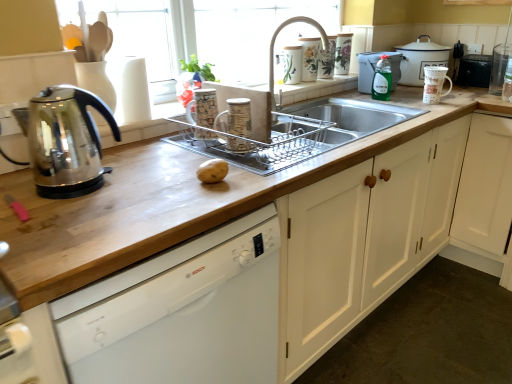
In order to face white enamel pot at upper right, which appears as the 3th kitchen appliance when ordered from the bottom, should I rotate leftwards or rightwards?

You should rotate right by 20.833 degrees.

What is the approximate height of matte ceramic mugs at center, the 1th appliance from the left?

The height of matte ceramic mugs at center, the 1th appliance from the left, is 6.93 inches.

This screenshot has width=512, height=384. I want to click on matte ceramic mugs at center, the seventh appliance in the right-to-left sequence, so click(203, 108).

This screenshot has height=384, width=512. Describe the element at coordinates (250, 33) in the screenshot. I see `transparent glass window screen at upper center` at that location.

Measure the distance between point (302, 28) and camera.

Point (302, 28) and camera are 6.94 feet apart from each other.

You are a GUI agent. You are given a task and a screenshot of the screen. Output one action in this format:
    pyautogui.click(x=<x>, y=<y>)
    Task: Click on the brown matte potato at center
    
    Given the screenshot: What is the action you would take?
    pyautogui.click(x=212, y=171)

Locate an element on the screen. Image resolution: width=512 pixels, height=384 pixels. transparent glass kettle at left, the first kitchen appliance in the left-to-right sequence is located at coordinates tap(66, 142).

Who is smaller, porcelain floral vase at upper center, which is the 4th appliance in left-to-right order, or transparent glass window screen at upper center?

porcelain floral vase at upper center, which is the 4th appliance in left-to-right order.

This screenshot has width=512, height=384. In order to click on the 1st appliance positioned above the transparent glass window screen at upper center (from the image's perspective) in this screenshot , I will do `click(309, 58)`.

Is transparent glass window screen at upper center at the back of porcelain floral vase at upper center, which is the 4th appliance in left-to-right order?

Yes, porcelain floral vase at upper center, which is the 4th appliance in left-to-right order, is positioned with its back facing transparent glass window screen at upper center.

Can you confirm if green plastic bottle at upper right, the 2th kitchen appliance ordered from the bottom, is positioned to the right of porcelain floral mug at upper center, the third appliance viewed from the left?

Indeed, green plastic bottle at upper right, the 2th kitchen appliance ordered from the bottom, is positioned on the right side of porcelain floral mug at upper center, the third appliance viewed from the left.

From the image's perspective, is green plastic bottle at upper right, the 2th kitchen appliance from the front, above porcelain floral mug at upper center, the fifth appliance when ordered from right to left?

No, from the image's perspective, green plastic bottle at upper right, the 2th kitchen appliance from the front, is not over porcelain floral mug at upper center, the fifth appliance when ordered from right to left.

Which of these two, green plastic bottle at upper right, positioned as the 2th kitchen appliance in right-to-left order, or porcelain floral mug at upper center, the fifth appliance when ordered from right to left, is bigger?

green plastic bottle at upper right, positioned as the 2th kitchen appliance in right-to-left order.

From the picture: Would you say porcelain floral mug at upper center, the fifth appliance when ordered from right to left, is inside or outside silver metallic faucet at upper center?

porcelain floral mug at upper center, the fifth appliance when ordered from right to left, is not inside silver metallic faucet at upper center, it's outside.

Can you confirm if porcelain floral mug at upper center, the fifth appliance when ordered from right to left, is taller than silver metallic faucet at upper center?

No, porcelain floral mug at upper center, the fifth appliance when ordered from right to left, is not taller than silver metallic faucet at upper center.

Does porcelain floral mug at upper center, the fifth appliance when ordered from right to left, have a greater width compared to silver metallic faucet at upper center?

Incorrect, the width of porcelain floral mug at upper center, the fifth appliance when ordered from right to left, does not surpass that of silver metallic faucet at upper center.

From the image's perspective, does porcelain floral mug at upper center, the fifth appliance when ordered from right to left, appear higher than silver metallic faucet at upper center?

Yes.

Is there a large distance between porcelain floral vase at upper center, positioned as the fifth appliance in left-to-right order, and matte ceramic mugs at center, the 1th appliance from the left?

Absolutely, porcelain floral vase at upper center, positioned as the fifth appliance in left-to-right order, is distant from matte ceramic mugs at center, the 1th appliance from the left.

How much distance is there between porcelain floral vase at upper center, positioned as the fifth appliance in left-to-right order, and matte ceramic mugs at center, the seventh appliance in the right-to-left sequence?

porcelain floral vase at upper center, positioned as the fifth appliance in left-to-right order, and matte ceramic mugs at center, the seventh appliance in the right-to-left sequence, are 1.11 meters apart.

Considering the positions of points (346, 50) and (192, 110), is point (346, 50) farther from camera compared to point (192, 110)?

Yes, point (346, 50) is farther from viewer.

Which object is further away from the camera, porcelain floral vase at upper center, positioned as the fifth appliance in left-to-right order, or matte ceramic mugs at center, the seventh appliance in the right-to-left sequence?

porcelain floral vase at upper center, positioned as the fifth appliance in left-to-right order.

Is white glossy dishwasher at center situated inside porcelain floral vase at upper center, which is the 4th appliance in left-to-right order, or outside?

white glossy dishwasher at center exists outside the volume of porcelain floral vase at upper center, which is the 4th appliance in left-to-right order.

Considering the relative sizes of white glossy dishwasher at center and porcelain floral vase at upper center, which is the 4th appliance in left-to-right order, in the image provided, is white glossy dishwasher at center bigger than porcelain floral vase at upper center, which is the 4th appliance in left-to-right order,?

Correct, white glossy dishwasher at center is larger in size than porcelain floral vase at upper center, which is the 4th appliance in left-to-right order.

From the white glossy dishwasher at center, count 4th appliance to the right and point to it. Please provide its 2D coordinates.

[(309, 58)]

Considering the relative sizes of brown matte potato at center and black plastic trash can at upper right, which ranks as the 2th appliance in right-to-left order, in the image provided, is brown matte potato at center shorter than black plastic trash can at upper right, which ranks as the 2th appliance in right-to-left order,?

Yes, brown matte potato at center is shorter than black plastic trash can at upper right, which ranks as the 2th appliance in right-to-left order.

Is brown matte potato at center located outside black plastic trash can at upper right, which ranks as the 2th appliance in right-to-left order?

Absolutely, brown matte potato at center is external to black plastic trash can at upper right, which ranks as the 2th appliance in right-to-left order.

Can you tell me how much brown matte potato at center and black plastic trash can at upper right, which ranks as the 2th appliance in right-to-left order, differ in facing direction?

The angular difference between brown matte potato at center and black plastic trash can at upper right, which ranks as the 2th appliance in right-to-left order, is 90 degrees.

Consider the image. Is there a large distance between brown matte potato at center and black plastic trash can at upper right, which ranks as the 2th appliance in right-to-left order?

Yes, brown matte potato at center and black plastic trash can at upper right, which ranks as the 2th appliance in right-to-left order, are located far from each other.

Is black plastic trash can at upper right, which ranks as the 2th appliance in right-to-left order, aimed at green glass bottle at upper right?

Yes, black plastic trash can at upper right, which ranks as the 2th appliance in right-to-left order, is aimed at green glass bottle at upper right.

Can you confirm if black plastic trash can at upper right, the 6th appliance viewed from the left, is shorter than green glass bottle at upper right?

Correct, black plastic trash can at upper right, the 6th appliance viewed from the left, is not as tall as green glass bottle at upper right.

Does black plastic trash can at upper right, which ranks as the 2th appliance in right-to-left order, touch green glass bottle at upper right?

black plastic trash can at upper right, which ranks as the 2th appliance in right-to-left order, is not next to green glass bottle at upper right, and they're not touching.

Does black plastic trash can at upper right, the 6th appliance viewed from the left, contain green glass bottle at upper right?

No.

Identify the location of window screen that is in front of the porcelain floral vase at upper center, marked as the fourth appliance in a right-to-left arrangement. (250, 33).

Where is `the 1st kitchen appliance to the right of the porcelain floral mug at upper center, the fifth appliance when ordered from right to left, starting your count from the anchor`? This screenshot has height=384, width=512. the 1st kitchen appliance to the right of the porcelain floral mug at upper center, the fifth appliance when ordered from right to left, starting your count from the anchor is located at coordinates (374, 69).

When comparing their distances from brown matte potato at center, does white enamel pot at upper right, which appears as the 3th kitchen appliance when ordered from the bottom, or porcelain floral vase at upper center, which is counted as the third appliance, starting from the right, seem closer?

porcelain floral vase at upper center, which is counted as the third appliance, starting from the right, lies closer to brown matte potato at center than the other object.

Looking at the image, which one is located closer to black plastic trash can at upper right, the 6th appliance viewed from the left, clear glass at upper right, the 7th appliance in the left-to-right sequence, or porcelain floral vase at upper center, which is counted as the third appliance, starting from the right?

clear glass at upper right, the 7th appliance in the left-to-right sequence, is closer to black plastic trash can at upper right, the 6th appliance viewed from the left.

Looking at the image, which one is located further to porcelain floral mug at upper center, the third appliance viewed from the left, brown matte potato at center or black plastic trash can at upper right, the 6th appliance viewed from the left?

brown matte potato at center is further to porcelain floral mug at upper center, the third appliance viewed from the left.

When comparing their distances from porcelain floral mug at upper center, the fifth appliance when ordered from right to left, does brown matte potato at center or green plastic bottle at upper right, which is the 2th kitchen appliance in back-to-front order, seem further?

brown matte potato at center lies further to porcelain floral mug at upper center, the fifth appliance when ordered from right to left, than the other object.

Looking at the image, which one is located further to matte ceramic mug at upper center, the second appliance in the left-to-right sequence, black plastic trash can at upper right, which ranks as the 2th appliance in right-to-left order, or white glossy dishwasher at center?

The object further to matte ceramic mug at upper center, the second appliance in the left-to-right sequence, is black plastic trash can at upper right, which ranks as the 2th appliance in right-to-left order.

When comparing their distances from porcelain floral vase at upper center, which is counted as the third appliance, starting from the right, does white wood cabinet at center or transparent glass window screen at upper center seem closer?

Based on the image, transparent glass window screen at upper center appears to be nearer to porcelain floral vase at upper center, which is counted as the third appliance, starting from the right.

From the image, which object appears to be farther from porcelain floral mug at upper center, the third appliance viewed from the left, transparent glass window screen at upper center or matte ceramic mugs at center, the 1th appliance from the left?

Among the two, matte ceramic mugs at center, the 1th appliance from the left, is located further to porcelain floral mug at upper center, the third appliance viewed from the left.

Considering their positions, is transparent glass kettle at left, which appears as the 1th kitchen appliance when ordered from the bottom, positioned closer to porcelain floral vase at upper center, marked as the fourth appliance in a right-to-left arrangement, than porcelain floral mug at upper center, the third appliance viewed from the left?

porcelain floral mug at upper center, the third appliance viewed from the left.

Where is `faucet between transparent glass kettle at left, the third kitchen appliance when ordered from right to left, and porcelain floral mug at upper center, the fifth appliance when ordered from right to left, from front to back`? faucet between transparent glass kettle at left, the third kitchen appliance when ordered from right to left, and porcelain floral mug at upper center, the fifth appliance when ordered from right to left, from front to back is located at coordinates (274, 45).

Locate an element on the screen. The width and height of the screenshot is (512, 384). potato between white glossy dishwasher at center and white enamel pot at upper right, the third kitchen appliance positioned from the left, in the front-back direction is located at coordinates (212, 171).

The width and height of the screenshot is (512, 384). I want to click on kitchen appliance between matte ceramic mug at upper center, the second appliance in the left-to-right sequence, and white glossy dishwasher at center in the up-down direction, so click(x=66, y=142).

Locate an element on the screen. The height and width of the screenshot is (384, 512). window screen between white wood cabinet at center and porcelain floral vase at upper center, positioned as the fifth appliance in left-to-right order, in the front-back direction is located at coordinates (250, 33).